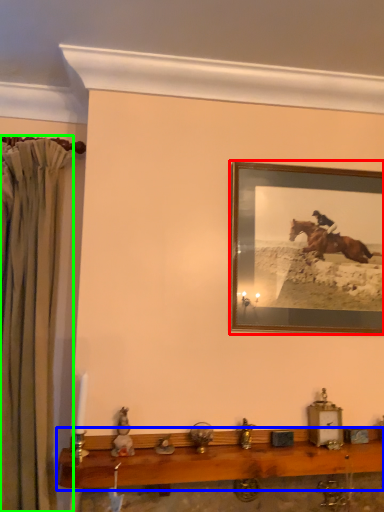
Question: Based on their relative distances, which object is farther from picture frame (highlighted by a red box)? Choose from table (highlighted by a blue box) and curtain (highlighted by a green box).

Choices:
 (A) table
 (B) curtain

Answer: (B)